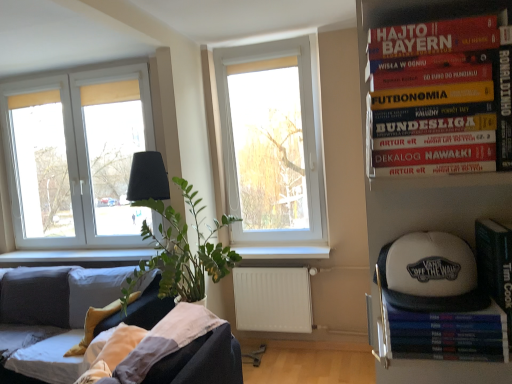
Question: Can you confirm if velvet dark grey couch at lower left is wider than white matte radiator at lower center?

Choices:
 (A) yes
 (B) no

Answer: (A)

Question: From a real-world perspective, is velvet dark grey couch at lower left positioned over white matte radiator at lower center based on gravity?

Choices:
 (A) no
 (B) yes

Answer: (B)

Question: Does velvet dark grey couch at lower left have a greater height compared to white matte radiator at lower center?

Choices:
 (A) no
 (B) yes

Answer: (B)

Question: From the image's perspective, is velvet dark grey couch at lower left below white matte radiator at lower center?

Choices:
 (A) no
 (B) yes

Answer: (B)

Question: Is white matte radiator at lower center completely or partially inside velvet dark grey couch at lower left?

Choices:
 (A) yes
 (B) no

Answer: (B)

Question: From the image's perspective, is velvet dark grey couch at lower left positioned above or below white wood window sill at center?

Choices:
 (A) above
 (B) below

Answer: (B)

Question: Is velvet dark grey couch at lower left bigger or smaller than white wood window sill at center?

Choices:
 (A) big
 (B) small

Answer: (A)

Question: Is velvet dark grey couch at lower left spatially inside white wood window sill at center, or outside of it?

Choices:
 (A) outside
 (B) inside

Answer: (A)

Question: Considering the positions of point click(170, 299) and point click(289, 244), is point click(170, 299) closer or farther from the camera than point click(289, 244)?

Choices:
 (A) closer
 (B) farther

Answer: (A)

Question: Is green matte paperback book at right, the 1th paperback book positioned from the right, in front of or behind white wood window sill at center in the image?

Choices:
 (A) behind
 (B) front

Answer: (B)

Question: From a real-world perspective, is green matte paperback book at right, the 1th paperback book positioned from the right, physically located above or below white wood window sill at center?

Choices:
 (A) above
 (B) below

Answer: (A)

Question: Based on their positions, is green matte paperback book at right, the 1th paperback book positioned from the right, located to the left or right of white wood window sill at center?

Choices:
 (A) right
 (B) left

Answer: (A)

Question: From the image's perspective, is green matte paperback book at right, acting as the second paperback book starting from the left, located above or below white wood window sill at center?

Choices:
 (A) above
 (B) below

Answer: (A)

Question: Relative to white plastic window at center, which ranks as the 1th window in right-to-left order, is white fabric baseball cap at right in front or behind?

Choices:
 (A) front
 (B) behind

Answer: (A)

Question: From their relative heights in the image, would you say white fabric baseball cap at right is taller or shorter than white plastic window at center, which is the 2th window in left-to-right order?

Choices:
 (A) short
 (B) tall

Answer: (A)